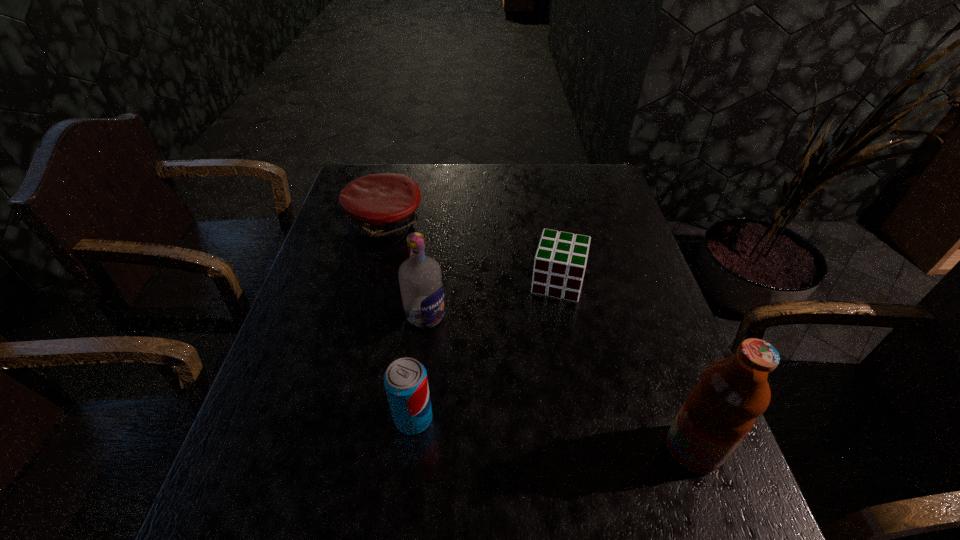
Identify the location of blank area located at the front of the farthest object where the visor is located. (453, 299).

Identify the location of free space located at the front of the farthest object where the visor is located. This screenshot has width=960, height=540. (478, 325).

Image resolution: width=960 pixels, height=540 pixels. I want to click on vacant region located at the front of the farthest object where the visor is located, so click(451, 296).

The image size is (960, 540). Identify the location of vacant region located 0.290m on the label of the second tallest object. (532, 402).

Image resolution: width=960 pixels, height=540 pixels. I want to click on vacant region located on the label of the second tallest object, so click(497, 373).

Locate an element on the screen. free space located on the label of the second tallest object is located at coordinates (477, 357).

Where is `vacant space situated 0.170m on the red face of the second object from right to left`? This screenshot has width=960, height=540. vacant space situated 0.170m on the red face of the second object from right to left is located at coordinates (540, 354).

This screenshot has height=540, width=960. I want to click on vacant space located 0.120m on the red face of the second object from right to left, so click(545, 338).

Locate an element on the screen. The height and width of the screenshot is (540, 960). free space located 0.280m on the red face of the second object from right to left is located at coordinates (532, 395).

Where is `object that is at the far edge`? Image resolution: width=960 pixels, height=540 pixels. object that is at the far edge is located at coordinates (380, 207).